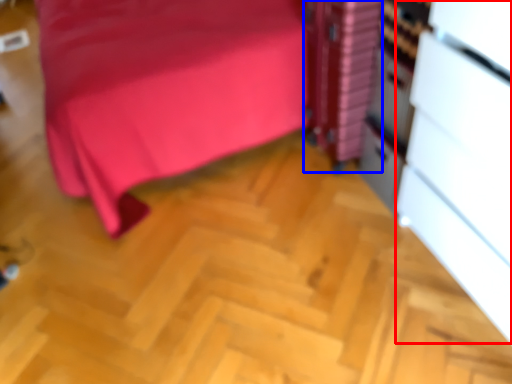
Question: Which object is closer to the camera taking this photo, file cabinet (highlighted by a red box) or file cabinet (highlighted by a blue box)?

Choices:
 (A) file cabinet
 (B) file cabinet

Answer: (A)